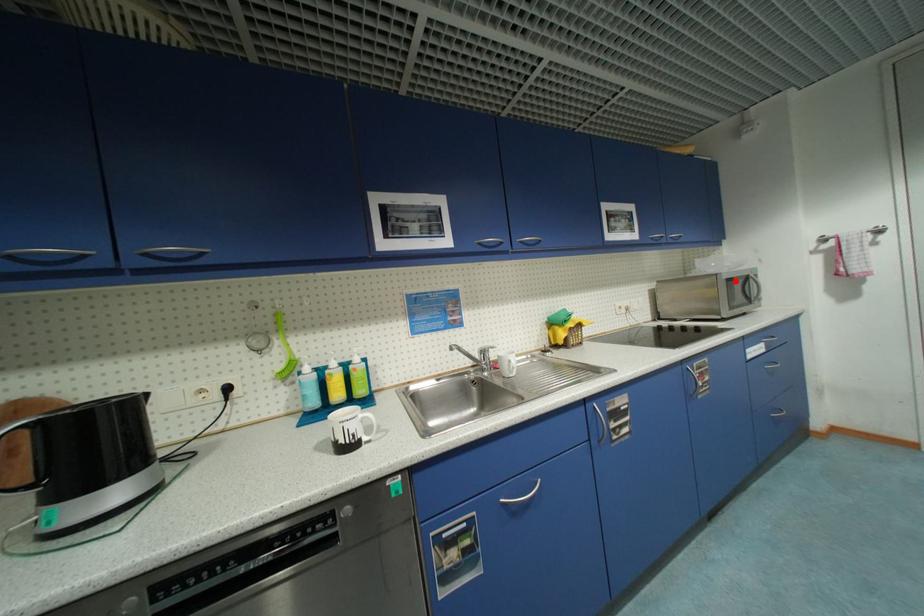
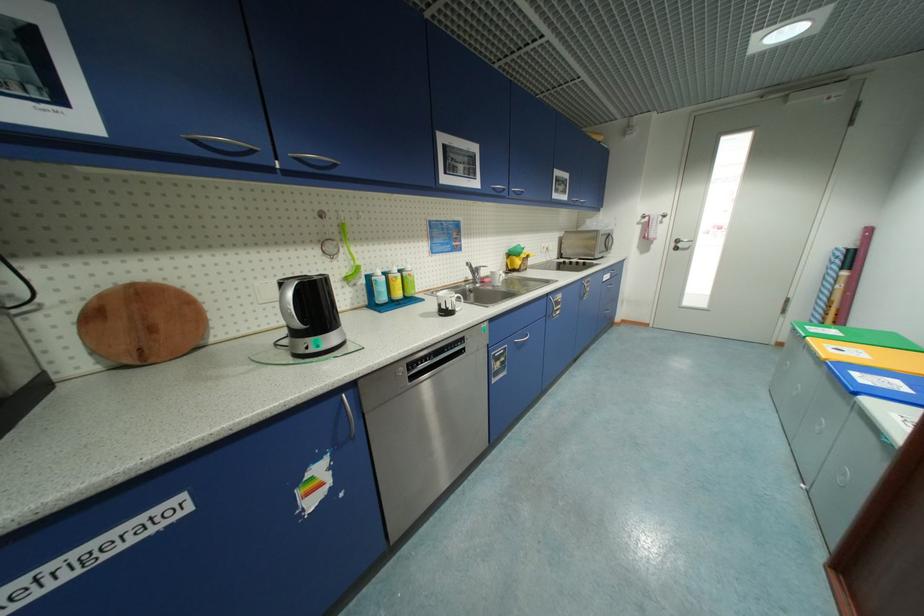
Question: I am providing you with two images of the same scene from different viewpoints. In image1, a red point is highlighted. Considering the same 3D point in image2, which of the following is correct?

Choices:
 (A) It is closer
 (B) It is farther

Answer: (A)